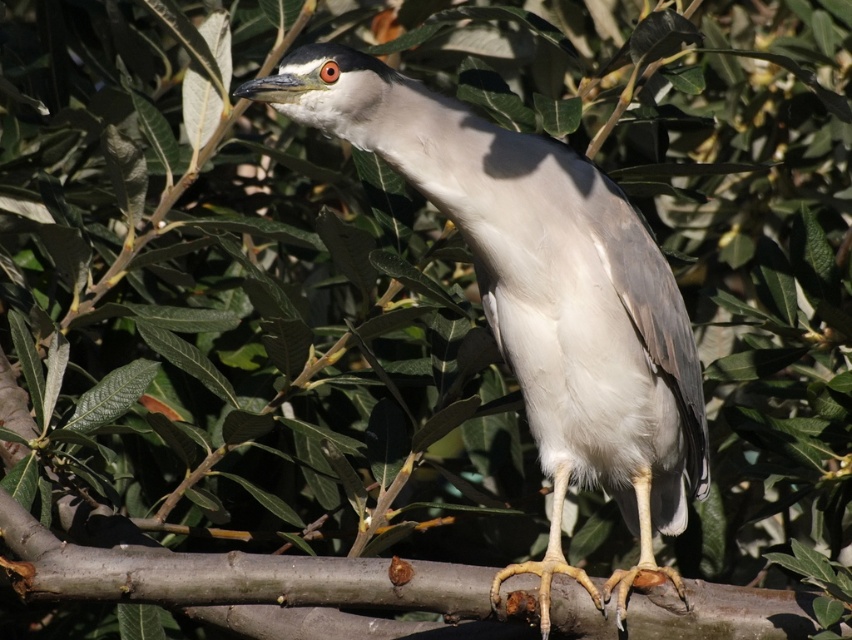
Question: Is white matte bird at center smaller than brown rough tree branch at center?

Choices:
 (A) yes
 (B) no

Answer: (B)

Question: Which point is closer to the camera?

Choices:
 (A) (694, 628)
 (B) (602, 428)

Answer: (A)

Question: Which point appears farthest from the camera in this image?

Choices:
 (A) (19, 513)
 (B) (478, 236)

Answer: (B)

Question: Does white matte bird at center come behind brown rough tree branch at center?

Choices:
 (A) yes
 (B) no

Answer: (A)

Question: Which point is closer to the camera taking this photo?

Choices:
 (A) (672, 317)
 (B) (315, 566)

Answer: (B)

Question: Does white matte bird at center have a smaller size compared to brown rough tree branch at center?

Choices:
 (A) no
 (B) yes

Answer: (A)